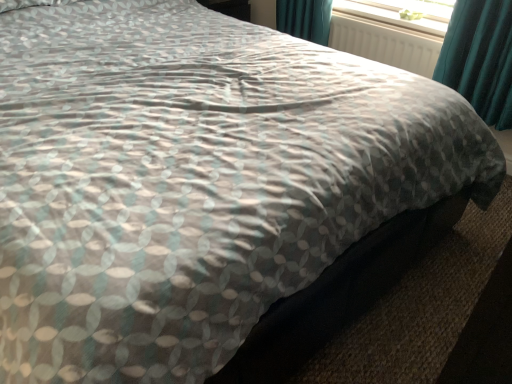
Question: From a real-world perspective, is white textured radiator at upper center located beneath transparent plastic window screen at upper right?

Choices:
 (A) no
 (B) yes

Answer: (B)

Question: Can you confirm if white textured radiator at upper center is smaller than transparent plastic window screen at upper right?

Choices:
 (A) no
 (B) yes

Answer: (A)

Question: Does white textured radiator at upper center lie behind transparent plastic window screen at upper right?

Choices:
 (A) yes
 (B) no

Answer: (B)

Question: Considering the relative positions of white textured radiator at upper center and transparent plastic window screen at upper right in the image provided, is white textured radiator at upper center to the right of transparent plastic window screen at upper right from the viewer's perspective?

Choices:
 (A) yes
 (B) no

Answer: (B)

Question: Is white textured radiator at upper center wider than transparent plastic window screen at upper right?

Choices:
 (A) no
 (B) yes

Answer: (A)

Question: Does white textured radiator at upper center have a lesser height compared to transparent plastic window screen at upper right?

Choices:
 (A) no
 (B) yes

Answer: (A)

Question: Does transparent plastic window screen at upper right have a lesser height compared to white textured radiator at upper center?

Choices:
 (A) no
 (B) yes

Answer: (B)

Question: From a real-world perspective, is transparent plastic window screen at upper right physically above white textured radiator at upper center?

Choices:
 (A) yes
 (B) no

Answer: (A)

Question: Would you say transparent plastic window screen at upper right is a long distance from white textured radiator at upper center?

Choices:
 (A) no
 (B) yes

Answer: (A)

Question: Does transparent plastic window screen at upper right lie in front of white textured radiator at upper center?

Choices:
 (A) no
 (B) yes

Answer: (A)

Question: Could white textured radiator at upper center be considered to be inside transparent plastic window screen at upper right?

Choices:
 (A) no
 (B) yes

Answer: (A)

Question: Is transparent plastic window screen at upper right wider than white textured radiator at upper center?

Choices:
 (A) yes
 (B) no

Answer: (A)

Question: In the image, is white textured radiator at upper center positioned in front of or behind transparent plastic window screen at upper right?

Choices:
 (A) front
 (B) behind

Answer: (A)